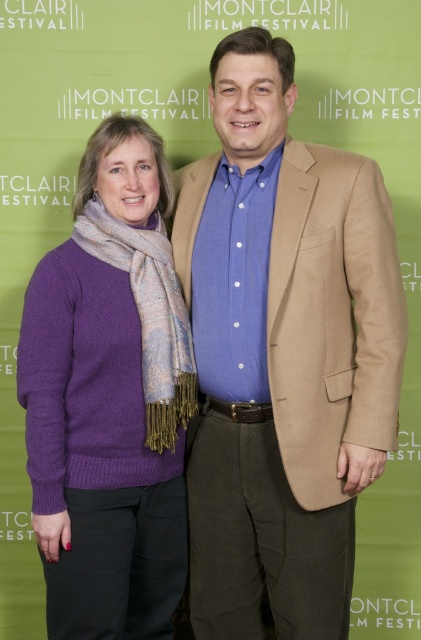
Between matte beige blazer at center and purple wool sweater at left, which one has more height?

With more height is matte beige blazer at center.

Who is positioned more to the left, matte beige blazer at center or purple wool sweater at left?

purple wool sweater at left

Identify the location of matte beige blazer at center. The image size is (421, 640). click(x=282, y=353).